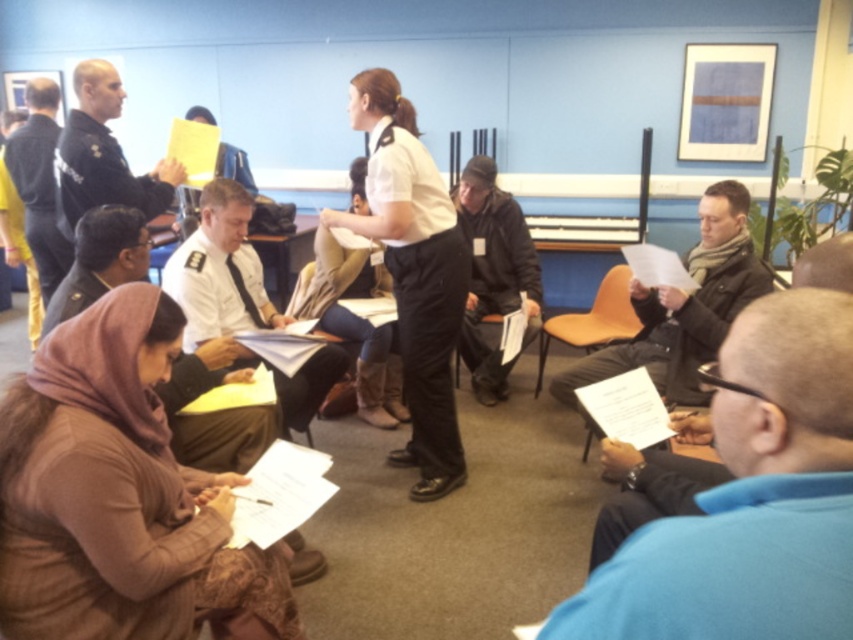
Is blue fabric shirt at lower right below orange plastic chair at center?

Correct, blue fabric shirt at lower right is located below orange plastic chair at center.

Where is `blue fabric shirt at lower right`? The height and width of the screenshot is (640, 853). blue fabric shirt at lower right is located at coordinates (750, 499).

Based on the photo, is brown textured hijab at lower left in front of dark blue uniform at upper left?

That is True.

Between brown textured hijab at lower left and dark blue uniform at upper left, which one has more height?

brown textured hijab at lower left is taller.

Locate an element on the screen. This screenshot has height=640, width=853. brown textured hijab at lower left is located at coordinates (119, 496).

How far apart are black matte jacket at center and dark blue uniform at left?

black matte jacket at center is 7.95 feet away from dark blue uniform at left.

Who is more forward, [631,362] or [35,221]?

Point [631,362] is more forward.

Identify the location of black matte jacket at center. The height and width of the screenshot is (640, 853). (683, 307).

Locate an element on the screen. The image size is (853, 640). black matte jacket at center is located at coordinates (683, 307).